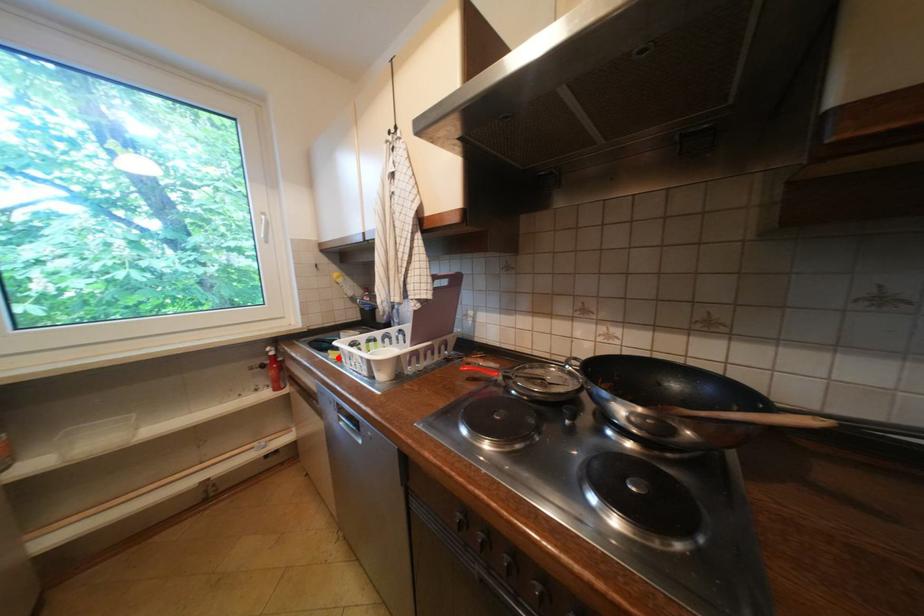
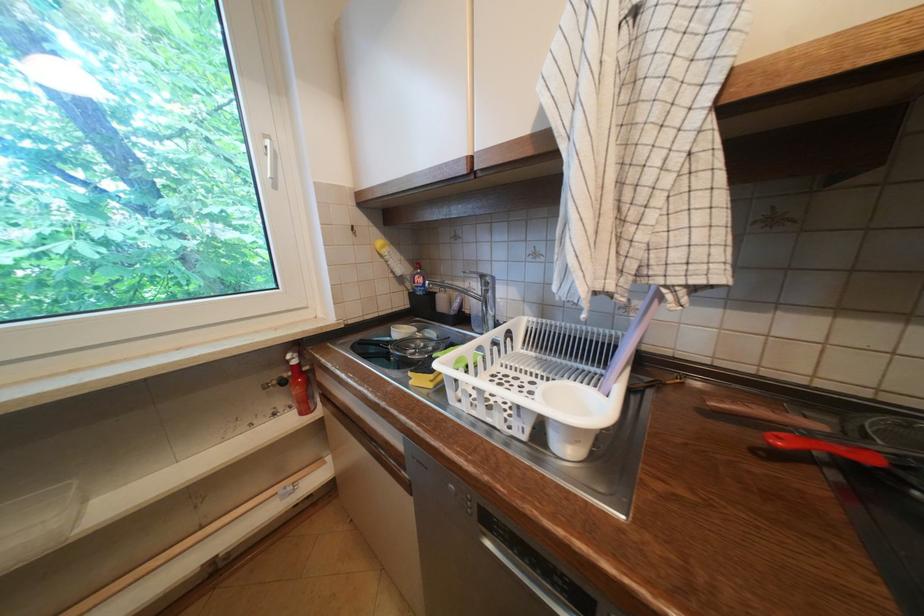
Where in the second image is the point corresponding to the highlighted location from the first image?

(419, 383)